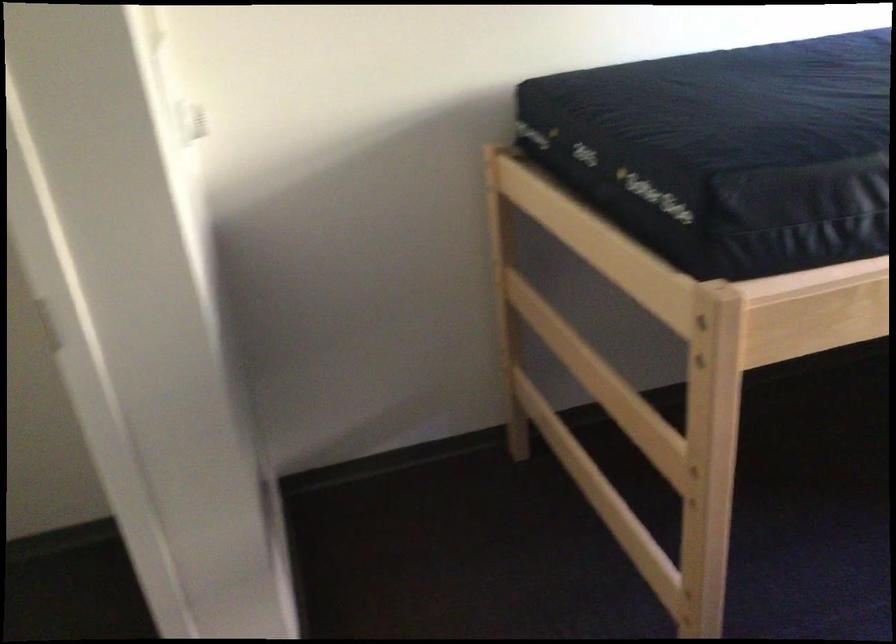
Image resolution: width=896 pixels, height=644 pixels. I want to click on white light switch, so click(x=190, y=117).